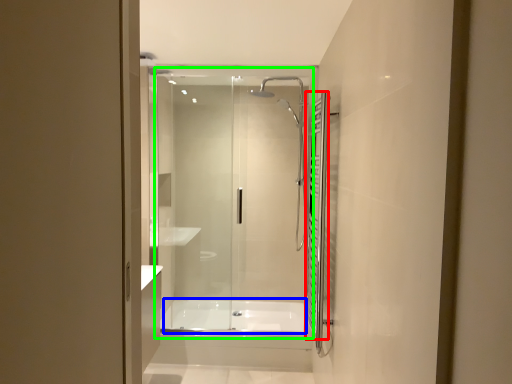
Question: Which object is the closest to the shower curtain (highlighted by a red box)? Choose among these: bath (highlighted by a blue box) or glass door (highlighted by a green box).

Choices:
 (A) bath
 (B) glass door

Answer: (B)